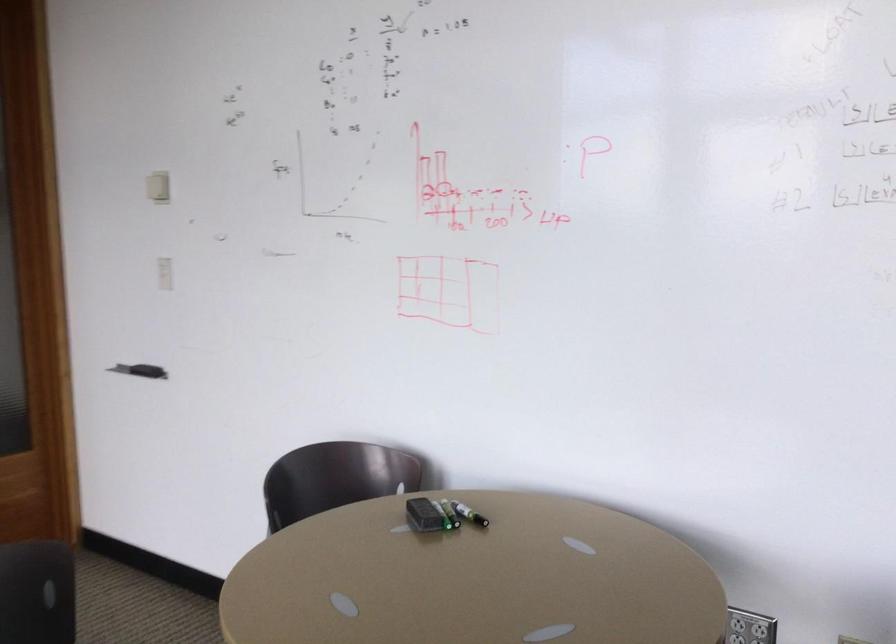
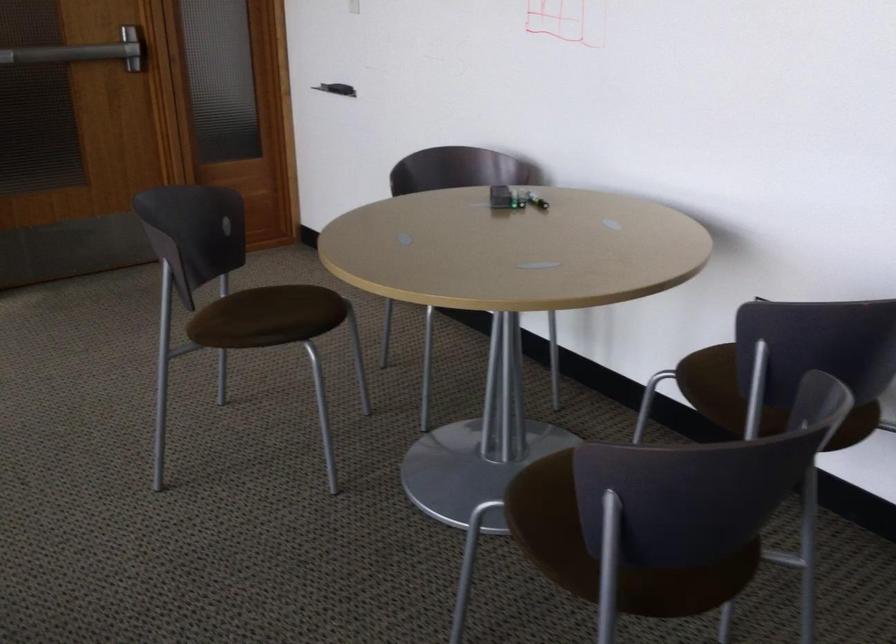
The images are taken continuously from a first-person perspective. In which direction is your viewpoint rotating?

The rotation direction of the camera is left-down.